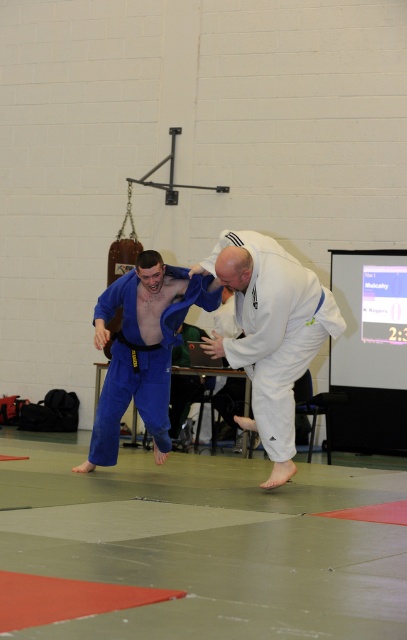
Who is higher up, white matte kimono at center or blue fabric at center?

white matte kimono at center is above.

Is white matte kimono at center to the left of blue fabric at center from the viewer's perspective?

In fact, white matte kimono at center is to the right of blue fabric at center.

This screenshot has width=407, height=640. I want to click on white matte kimono at center, so pos(271,332).

Locate an element on the screen. This screenshot has width=407, height=640. white matte kimono at center is located at coordinates (271, 332).